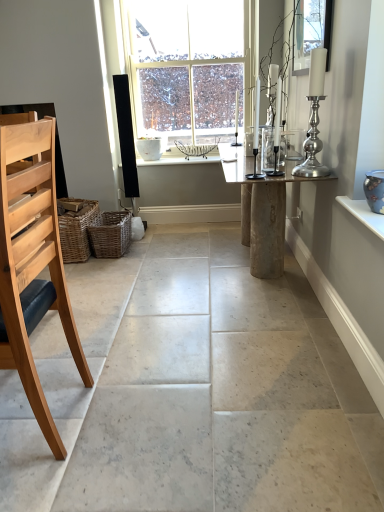
Question: Is natural wood chair at left at the back of woven brown basket at lower left, positioned as the first basket in right-to-left order?

Choices:
 (A) no
 (B) yes

Answer: (A)

Question: From the image's perspective, is woven brown basket at lower left, the 2th basket when ordered from left to right, under natural wood chair at left?

Choices:
 (A) no
 (B) yes

Answer: (A)

Question: Considering the relative sizes of woven brown basket at lower left, positioned as the first basket in right-to-left order, and natural wood chair at left in the image provided, is woven brown basket at lower left, positioned as the first basket in right-to-left order, wider than natural wood chair at left?

Choices:
 (A) yes
 (B) no

Answer: (A)

Question: Is woven brown basket at lower left, positioned as the first basket in right-to-left order, surrounding natural wood chair at left?

Choices:
 (A) no
 (B) yes

Answer: (A)

Question: Is woven brown basket at lower left, positioned as the first basket in right-to-left order, thinner than natural wood chair at left?

Choices:
 (A) no
 (B) yes

Answer: (A)

Question: Would you say woven brown basket at lower left, the 2th basket when ordered from left to right, is outside natural wood chair at left?

Choices:
 (A) no
 (B) yes

Answer: (B)

Question: Does woven brown basket at lower left, arranged as the 1th basket when viewed from the left, appear on the right side of woven brown basket at lower left, the 2th basket when ordered from left to right?

Choices:
 (A) yes
 (B) no

Answer: (B)

Question: Can you confirm if woven brown basket at lower left, arranged as the second basket when viewed from the right, is smaller than woven brown basket at lower left, positioned as the first basket in right-to-left order?

Choices:
 (A) yes
 (B) no

Answer: (B)

Question: Is woven brown basket at lower left, arranged as the second basket when viewed from the right, further to the viewer compared to woven brown basket at lower left, the 2th basket when ordered from left to right?

Choices:
 (A) yes
 (B) no

Answer: (B)

Question: From a real-world perspective, is woven brown basket at lower left, arranged as the 1th basket when viewed from the left, below woven brown basket at lower left, the 2th basket when ordered from left to right?

Choices:
 (A) no
 (B) yes

Answer: (A)

Question: From a real-world perspective, is woven brown basket at lower left, arranged as the second basket when viewed from the right, located higher than woven brown basket at lower left, the 2th basket when ordered from left to right?

Choices:
 (A) yes
 (B) no

Answer: (A)

Question: Is woven brown basket at lower left, positioned as the first basket in right-to-left order, completely or partially inside woven brown basket at lower left, arranged as the 1th basket when viewed from the left?

Choices:
 (A) no
 (B) yes

Answer: (A)

Question: Can you see blue glossy vase at upper right touching woven brown basket at lower left, arranged as the 1th basket when viewed from the left?

Choices:
 (A) yes
 (B) no

Answer: (B)